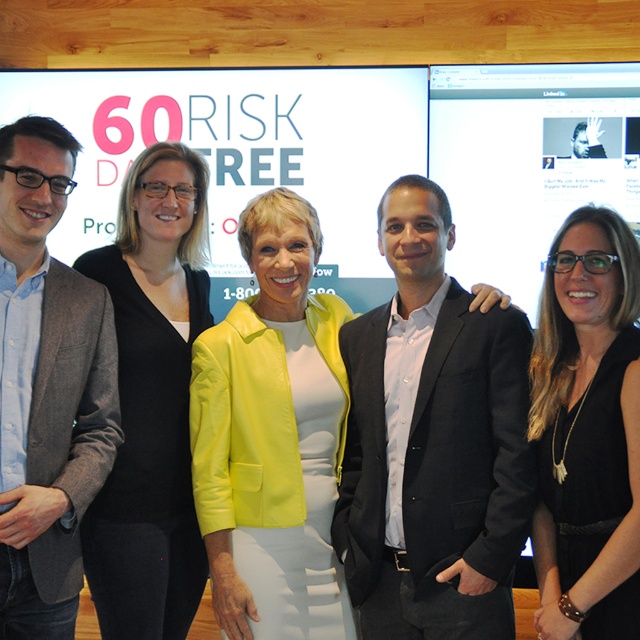
Question: Which object is the closest to the black matte dress at right?

Choices:
 (A) matte gray blazer at left
 (B) black suit at center
 (C) black matte dress at center

Answer: (B)

Question: Which is nearer to the black matte dress at center?

Choices:
 (A) black matte dress at right
 (B) black suit at center

Answer: (B)

Question: Is black suit at center behind black matte dress at right?

Choices:
 (A) yes
 (B) no

Answer: (A)

Question: Which of the following is the farthest from the observer?

Choices:
 (A) black matte dress at right
 (B) black suit at center

Answer: (B)

Question: Is black suit at center positioned at the back of bright yellow leather jacket at center?

Choices:
 (A) no
 (B) yes

Answer: (A)

Question: Can you confirm if matte gray blazer at left is smaller than black matte dress at center?

Choices:
 (A) yes
 (B) no

Answer: (A)